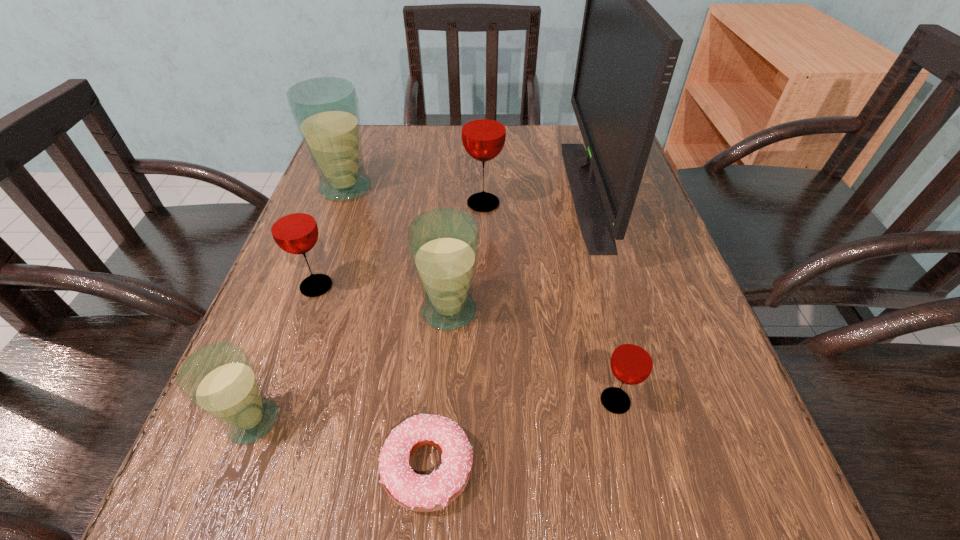
Locate an element on the screen. This screenshot has height=540, width=960. free area in between the farthest red glass and the doughnut is located at coordinates (455, 335).

In order to click on vacant space that is in between the tallest object and the doughnut in this screenshot , I will do `click(507, 329)`.

The image size is (960, 540). Find the location of `free area in between the pink doughnut and the second red glass from left to right`. free area in between the pink doughnut and the second red glass from left to right is located at coordinates (455, 335).

Locate an element on the screen. The width and height of the screenshot is (960, 540). vacant space that is in between the rightmost blue glass and the smallest blue glass is located at coordinates (351, 366).

In order to click on free space between the biggest blue glass and the leftmost red glass in this screenshot , I will do `click(331, 237)`.

Identify which object is the third closest to the second nearest red glass. Please provide its 2D coordinates. Your answer should be formatted as a tuple, i.e. [(x, y)], where the tuple contains the x and y coordinates of a point satisfying the conditions above.

[(326, 112)]

At what (x,y) coordinates should I click in order to perform the action: click on the third closest object to the smallest blue glass. Please return your answer as a coordinate pair (x, y). The image size is (960, 540). Looking at the image, I should click on (443, 243).

Locate which glass is the second closest to the farthest red glass. Please provide its 2D coordinates. Your answer should be formatted as a tuple, i.e. [(x, y)], where the tuple contains the x and y coordinates of a point satisfying the conditions above.

[(443, 243)]

Identify the location of glass that stands as the closest to the biggest red glass. Image resolution: width=960 pixels, height=540 pixels. (326, 112).

The width and height of the screenshot is (960, 540). I want to click on red glass that is the second nearest to the pink doughnut, so click(x=293, y=227).